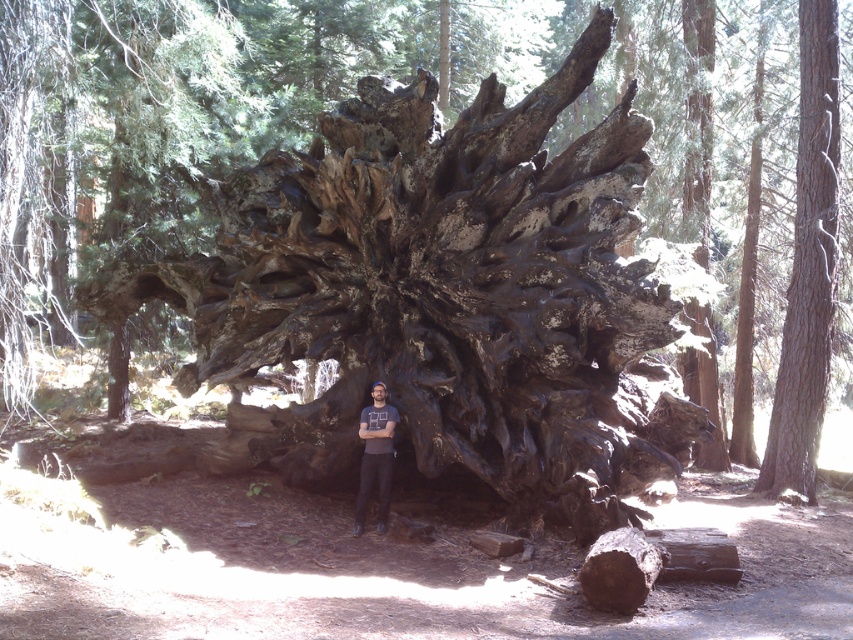
Does smooth brown bark at right have a lesser width compared to dark gray t-shirt at center?

Incorrect, smooth brown bark at right's width is not less than dark gray t-shirt at center's.

Who is more distant from viewer, (828, 160) or (364, 413)?

The point (828, 160) is behind.

Find the location of a particular element. The height and width of the screenshot is (640, 853). smooth brown bark at right is located at coordinates (808, 266).

You are a GUI agent. You are given a task and a screenshot of the screen. Output one action in this format:
    pyautogui.click(x=<x>, y=<y>)
    Task: Click on the smooth brown bark at right
    
    Given the screenshot: What is the action you would take?
    click(x=808, y=266)